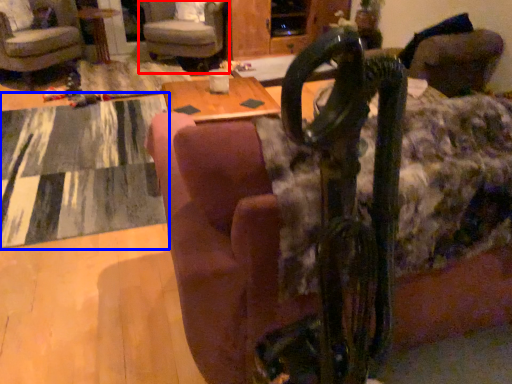
Question: Which object appears farthest to the camera in this image, chair (highlighted by a red box) or mat (highlighted by a blue box)?

Choices:
 (A) chair
 (B) mat

Answer: (A)